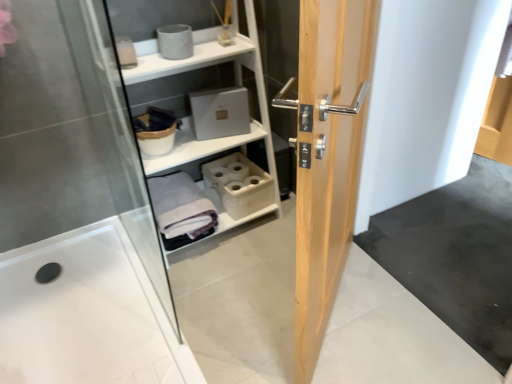
Identify the location of transparent glass shower door at left. (70, 134).

The width and height of the screenshot is (512, 384). What do you see at coordinates (327, 156) in the screenshot?
I see `light wood door at center` at bounding box center [327, 156].

In order to face white matte shelf at upper center, should I rotate leftwards or rightwards?

Rotate your view left by about 7.829°.

Identify the location of gray cotton bath towel at center. (181, 209).

Identify the location of transparent glass shower door at left. (70, 134).

Considering the points (298, 111) and (65, 320), which point is behind, point (298, 111) or point (65, 320)?

The point (65, 320) is farther from the camera.

Considering their positions, is light wood door at center located in front of or behind white glossy bath at lower left?

In the image, light wood door at center appears in front of white glossy bath at lower left.

Between light wood door at center and white glossy bath at lower left, which one has larger width?

white glossy bath at lower left.

Considering the sizes of objects light wood door at center and white glossy bath at lower left in the image provided, who is bigger, light wood door at center or white glossy bath at lower left?

light wood door at center.

Is gray cotton bath towel at center inside or outside of light wood door at center?

gray cotton bath towel at center is located beyond the bounds of light wood door at center.

Which point is more distant from viewer, (201, 191) or (337, 79)?

The point (201, 191) is farther.

Is gray cotton bath towel at center wider than light wood door at center?

Correct, the width of gray cotton bath towel at center exceeds that of light wood door at center.

Between white glossy bath at lower left and white matte shelf at upper center, which one has less height?

white glossy bath at lower left.

In the scene shown: Choose the correct answer: Is white glossy bath at lower left inside white matte shelf at upper center or outside it?

white glossy bath at lower left exists outside the volume of white matte shelf at upper center.

What's the angular difference between white glossy bath at lower left and white matte shelf at upper center's facing directions?

The angle between the facing direction of white glossy bath at lower left and the facing direction of white matte shelf at upper center is 1.4 degrees.

From a real-world perspective, which object stands above the other?

white matte shelf at upper center, from a real-world perspective.

Considering the relative sizes of white matte shelf at upper center and gray cotton bath towel at center in the image provided, is white matte shelf at upper center bigger than gray cotton bath towel at center?

Correct, white matte shelf at upper center is larger in size than gray cotton bath towel at center.

Considering the sizes of white matte shelf at upper center and gray cotton bath towel at center in the image, is white matte shelf at upper center wider or thinner than gray cotton bath towel at center?

In the image, white matte shelf at upper center appears to be more narrow than gray cotton bath towel at center.

Considering the points (234, 53) and (159, 217), which point is behind, point (234, 53) or point (159, 217)?

The point (159, 217) is farther.

Is white glossy bath at lower left not close to transparent glass shower door at left?

They are positioned close to each other.

Considering the relative sizes of white glossy bath at lower left and transparent glass shower door at left in the image provided, is white glossy bath at lower left bigger than transparent glass shower door at left?

Incorrect, white glossy bath at lower left is not larger than transparent glass shower door at left.

Is white glossy bath at lower left outside of transparent glass shower door at left?

Yes, white glossy bath at lower left is not within transparent glass shower door at left.

Which of these two, white glossy bath at lower left or transparent glass shower door at left, is wider?

white glossy bath at lower left.

From the image's perspective, relative to white glossy bath at lower left, is gray cotton bath towel at center above or below?

From the image's perspective, gray cotton bath towel at center appears above white glossy bath at lower left.

Which is more to the right, gray cotton bath towel at center or white glossy bath at lower left?

Positioned to the right is gray cotton bath towel at center.

Is gray cotton bath towel at center wider than white glossy bath at lower left?

No, gray cotton bath towel at center is not wider than white glossy bath at lower left.

Identify the location of bath that is below the gray cotton bath towel at center (from the image's perspective). The height and width of the screenshot is (384, 512). (86, 314).

Is the depth of gray cotton bath towel at center greater than that of white matte shelf at upper center?

Yes, gray cotton bath towel at center is behind white matte shelf at upper center.

From the image's perspective, between gray cotton bath towel at center and white matte shelf at upper center, who is located below?

gray cotton bath towel at center, from the image's perspective.

Between point (161, 191) and point (151, 100), which one is positioned in front?

The point (151, 100) is more forward.

Is gray cotton bath towel at center positioned with its back to white matte shelf at upper center?

Yes, gray cotton bath towel at center is facing away from white matte shelf at upper center.

What are the coordinates of `bath below the light wood door at center (from a real-world perspective)` in the screenshot? It's located at (86, 314).

You are a GUI agent. You are given a task and a screenshot of the screen. Output one action in this format:
    pyautogui.click(x=<x>, y=<y>)
    Task: Click on the bath towel on the left of light wood door at center
    This screenshot has height=384, width=512.
    Given the screenshot: What is the action you would take?
    pyautogui.click(x=181, y=209)

In the scene shown: Considering their positions, is gray cotton bath towel at center positioned further to light wood door at center than white glossy bath at lower left?

white glossy bath at lower left is further to light wood door at center.

Based on their spatial positions, is white glossy bath at lower left or gray cotton bath towel at center closer to transparent glass shower door at left?

gray cotton bath towel at center.

Considering their positions, is white glossy bath at lower left positioned closer to gray cotton bath towel at center than transparent glass shower door at left?

Based on the image, transparent glass shower door at left appears to be nearer to gray cotton bath towel at center.

Estimate the real-world distances between objects in this image. Which object is further from light wood door at center, white glossy bath at lower left or gray cotton bath towel at center?

white glossy bath at lower left lies further to light wood door at center than the other object.

Which object lies nearer to the anchor point white matte shelf at upper center, white glossy bath at lower left or gray cotton bath towel at center?

Based on the image, gray cotton bath towel at center appears to be nearer to white matte shelf at upper center.

Which object lies further to the anchor point gray cotton bath towel at center, light wood door at center or white matte shelf at upper center?

light wood door at center is positioned further to the anchor gray cotton bath towel at center.

Looking at the image, which one is located further to transparent glass shower door at left, light wood door at center or gray cotton bath towel at center?

The object further to transparent glass shower door at left is light wood door at center.

From the image, which object appears to be farther from white glossy bath at lower left, light wood door at center or white matte shelf at upper center?

Among the two, light wood door at center is located further to white glossy bath at lower left.

You are a GUI agent. You are given a task and a screenshot of the screen. Output one action in this format:
    pyautogui.click(x=<x>, y=<y>)
    Task: Click on the shelf between transparent glass shower door at left and gray cotton bath towel at center along the z-axis
    
    Given the screenshot: What is the action you would take?
    pyautogui.click(x=199, y=126)

Locate an element on the screen. shelf situated between white glossy bath at lower left and light wood door at center from left to right is located at coordinates (199, 126).

The image size is (512, 384). I want to click on bath towel that lies between white matte shelf at upper center and white glossy bath at lower left from top to bottom, so click(x=181, y=209).

Where is `shelf located between light wood door at center and gray cotton bath towel at center in the depth direction`? This screenshot has height=384, width=512. shelf located between light wood door at center and gray cotton bath towel at center in the depth direction is located at coordinates (199, 126).